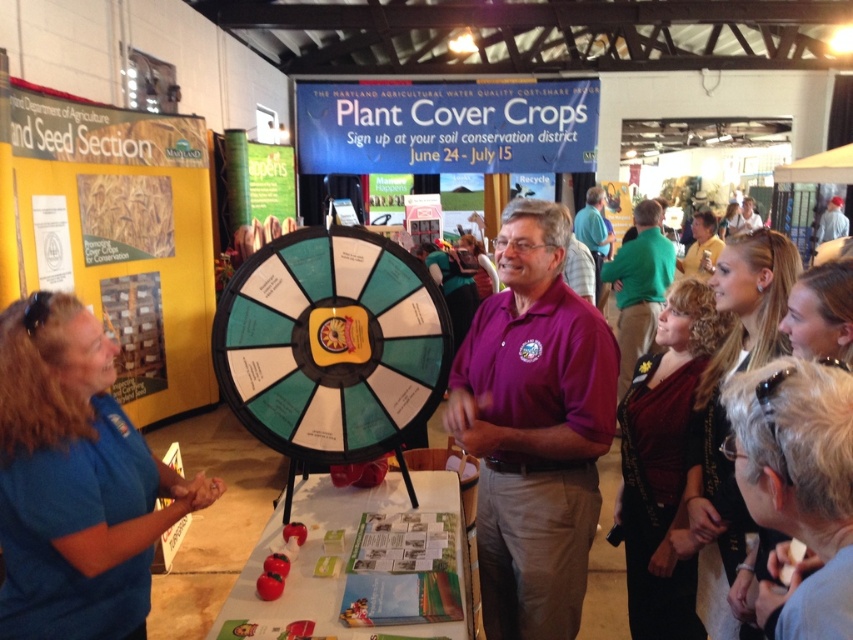
Question: Does purple cotton shirt at center come in front of teal plastic wheel at center?

Choices:
 (A) yes
 (B) no

Answer: (A)

Question: Which object is closer to the camera taking this photo?

Choices:
 (A) gray fur at lower right
 (B) teal plastic wheel at center

Answer: (A)

Question: Based on their relative distances, which object is farther from the gray fur at lower right?

Choices:
 (A) teal plastic wheel at center
 (B) blue fabric shirt at lower left
 (C) purple cotton shirt at center

Answer: (B)

Question: Can you confirm if blue fabric shirt at lower left is smaller than teal plastic wheel at center?

Choices:
 (A) no
 (B) yes

Answer: (A)

Question: Does teal plastic wheel at center appear under gray fur at lower right?

Choices:
 (A) yes
 (B) no

Answer: (B)

Question: Which of the following is the farthest from the observer?

Choices:
 (A) purple cotton shirt at center
 (B) teal plastic wheel at center

Answer: (B)